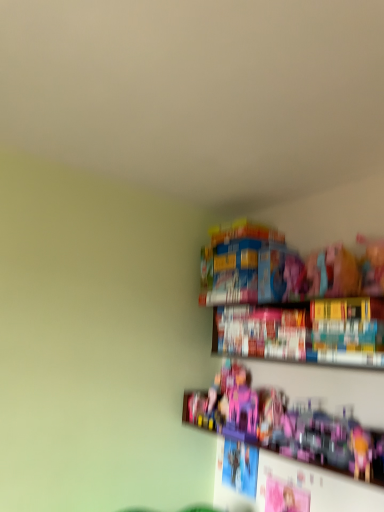
You are a GUI agent. You are given a task and a screenshot of the screen. Output one action in this format:
    pyautogui.click(x=<x>, y=<y>)
    Task: Click on the hardcover book at upper right
    
    Given the screenshot: What is the action you would take?
    pyautogui.click(x=297, y=336)

Image resolution: width=384 pixels, height=512 pixels. Identify the location of hardcover book at upper right. (297, 336).

From the image's perspective, is pink plastic castle at center, which is the 2th toy from right to left, above pink plastic toy at lower right, arranged as the second toy when viewed from the left?

Yes, from the image's perspective, pink plastic castle at center, which is the 2th toy from right to left, is on top of pink plastic toy at lower right, arranged as the second toy when viewed from the left.

Is pink plastic castle at center, acting as the first toy starting from the left, at the left side of pink plastic toy at lower right, arranged as the second toy when viewed from the left?

Indeed, pink plastic castle at center, acting as the first toy starting from the left, is positioned on the left side of pink plastic toy at lower right, arranged as the second toy when viewed from the left.

Is pink plastic castle at center, acting as the first toy starting from the left, next to pink plastic toy at lower right, arranged as the second toy when viewed from the left?

No, pink plastic castle at center, acting as the first toy starting from the left, is not with pink plastic toy at lower right, arranged as the second toy when viewed from the left.

Could you tell me if pink plastic castle at center, acting as the first toy starting from the left, is facing pink plastic toy at lower right, arranged as the second toy when viewed from the left?

Yes, pink plastic castle at center, acting as the first toy starting from the left, faces towards pink plastic toy at lower right, arranged as the second toy when viewed from the left.

Considering the positions of point (234, 408) and point (366, 349), is point (234, 408) closer or farther from the camera than point (366, 349)?

Point (234, 408) is positioned farther from the camera compared to point (366, 349).

Is pink plastic castle at center, which is the 2th toy from right to left, not within hardcover book at upper right?

Indeed, pink plastic castle at center, which is the 2th toy from right to left, is completely outside hardcover book at upper right.

From a real-world perspective, starting from the hardcover book at upper right, which toy is the 1st one below it? Please provide its 2D coordinates.

[(240, 399)]

Can you confirm if pink plastic castle at center, acting as the first toy starting from the left, is smaller than hardcover book at upper right?

Correct, pink plastic castle at center, acting as the first toy starting from the left, occupies less space than hardcover book at upper right.

Does hardcover book at upper right appear on the left side of pink plastic castle at center, which is the 2th toy from right to left?

Incorrect, hardcover book at upper right is not on the left side of pink plastic castle at center, which is the 2th toy from right to left.

How far apart are hardcover book at upper right and pink plastic castle at center, acting as the first toy starting from the left?

They are 36.57 centimeters apart.

Considering the sizes of objects hardcover book at upper right and pink plastic castle at center, acting as the first toy starting from the left, in the image provided, who is thinner, hardcover book at upper right or pink plastic castle at center, acting as the first toy starting from the left,?

pink plastic castle at center, acting as the first toy starting from the left, is thinner.

Is pink plastic toy at lower right, arranged as the second toy when viewed from the left, not close to hardcover book at upper right?

No, there isn't a large distance between pink plastic toy at lower right, arranged as the second toy when viewed from the left, and hardcover book at upper right.

From their relative heights in the image, would you say pink plastic toy at lower right, placed as the 1th toy when sorted from right to left, is taller or shorter than hardcover book at upper right?

Considering their sizes, pink plastic toy at lower right, placed as the 1th toy when sorted from right to left, has less height than hardcover book at upper right.

Which object is closer to the camera, pink plastic toy at lower right, placed as the 1th toy when sorted from right to left, or hardcover book at upper right?

pink plastic toy at lower right, placed as the 1th toy when sorted from right to left, is closer to the camera.

How many degrees apart are the facing directions of pink plastic toy at lower right, placed as the 1th toy when sorted from right to left, and hardcover book at upper right?

The facing directions of pink plastic toy at lower right, placed as the 1th toy when sorted from right to left, and hardcover book at upper right are 0.241 degrees apart.

Which is in front, point (343, 340) or point (345, 413)?

The point (343, 340) is closer.

Who is taller, hardcover book at upper right or pink plastic toy at lower right, arranged as the second toy when viewed from the left?

Standing taller between the two is hardcover book at upper right.

Considering the relative sizes of hardcover book at upper right and pink plastic toy at lower right, arranged as the second toy when viewed from the left, in the image provided, is hardcover book at upper right smaller than pink plastic toy at lower right, arranged as the second toy when viewed from the left,?

Incorrect, hardcover book at upper right is not smaller in size than pink plastic toy at lower right, arranged as the second toy when viewed from the left.

Considering the positions of objects hardcover book at upper right and pink plastic toy at lower right, arranged as the second toy when viewed from the left, in the image provided, who is in front, hardcover book at upper right or pink plastic toy at lower right, arranged as the second toy when viewed from the left,?

pink plastic toy at lower right, arranged as the second toy when viewed from the left, is more forward.

Is pink plastic toy at lower right, placed as the 1th toy when sorted from right to left, looking in the opposite direction of pink plastic castle at center, acting as the first toy starting from the left?

Yes, pink plastic toy at lower right, placed as the 1th toy when sorted from right to left, is facing away from pink plastic castle at center, acting as the first toy starting from the left.

Who is taller, pink plastic toy at lower right, placed as the 1th toy when sorted from right to left, or pink plastic castle at center, which is the 2th toy from right to left?

pink plastic castle at center, which is the 2th toy from right to left, is taller.

Can you see pink plastic toy at lower right, placed as the 1th toy when sorted from right to left, touching pink plastic castle at center, acting as the first toy starting from the left?

pink plastic toy at lower right, placed as the 1th toy when sorted from right to left, and pink plastic castle at center, acting as the first toy starting from the left, are clearly separated.

Does point (223, 364) appear closer or farther from the camera than point (236, 413)?

Point (223, 364).

The image size is (384, 512). In order to click on toy that is behind the pink plastic toy at lower right, placed as the 1th toy when sorted from right to left in this screenshot , I will do `click(240, 399)`.

The image size is (384, 512). In order to click on book on the right of pink plastic castle at center, acting as the first toy starting from the left in this screenshot , I will do `click(297, 336)`.

Based on their spatial positions, is pink plastic toy at lower right, arranged as the second toy when viewed from the left, or pink plastic castle at center, which is the 2th toy from right to left, closer to hardcover book at upper right?

pink plastic toy at lower right, arranged as the second toy when viewed from the left.

Considering their positions, is pink plastic castle at center, which is the 2th toy from right to left, positioned closer to hardcover book at upper right than pink plastic toy at lower right, arranged as the second toy when viewed from the left?

Based on the image, pink plastic toy at lower right, arranged as the second toy when viewed from the left, appears to be nearer to hardcover book at upper right.

Looking at the image, which one is located further to pink plastic toy at lower right, arranged as the second toy when viewed from the left, pink plastic castle at center, which is the 2th toy from right to left, or hardcover book at upper right?

hardcover book at upper right is positioned further to the anchor pink plastic toy at lower right, arranged as the second toy when viewed from the left.

When comparing their distances from pink plastic castle at center, acting as the first toy starting from the left, does pink plastic toy at lower right, placed as the 1th toy when sorted from right to left, or hardcover book at upper right seem further?

The object further to pink plastic castle at center, acting as the first toy starting from the left, is hardcover book at upper right.

Based on their spatial positions, is hardcover book at upper right or pink plastic castle at center, which is the 2th toy from right to left, closer to pink plastic toy at lower right, arranged as the second toy when viewed from the left?

The object closer to pink plastic toy at lower right, arranged as the second toy when viewed from the left, is pink plastic castle at center, which is the 2th toy from right to left.

Estimate the real-world distances between objects in this image. Which object is closer to pink plastic castle at center, acting as the first toy starting from the left, hardcover book at upper right or pink plastic toy at lower right, placed as the 1th toy when sorted from right to left?

pink plastic toy at lower right, placed as the 1th toy when sorted from right to left.

Where is `book positioned between pink plastic toy at lower right, arranged as the second toy when viewed from the left, and pink plastic castle at center, acting as the first toy starting from the left, from near to far`? book positioned between pink plastic toy at lower right, arranged as the second toy when viewed from the left, and pink plastic castle at center, acting as the first toy starting from the left, from near to far is located at coordinates (297, 336).